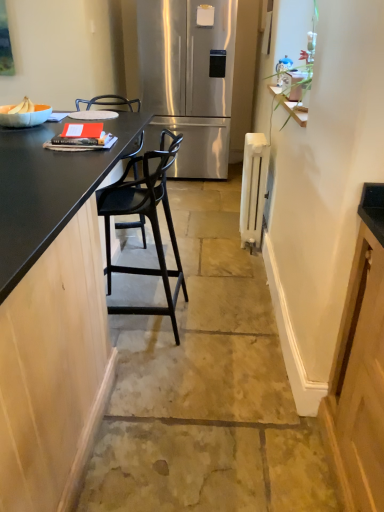
What are the coordinates of `vacant space to the right of black matte bar stool at center` in the screenshot? It's located at (222, 324).